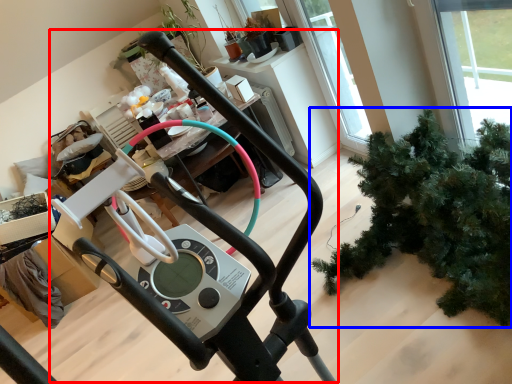
Question: Which of the following is the closest to the observer, sport equipment (highlighted by a red box) or houseplant (highlighted by a blue box)?

Choices:
 (A) sport equipment
 (B) houseplant

Answer: (A)